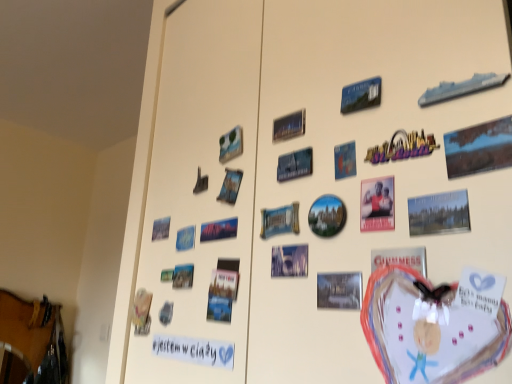
Image resolution: width=512 pixels, height=384 pixels. Describe the element at coordinates (361, 95) in the screenshot. I see `blue plastic postcard at upper right, which is the fifth postcard from right to left` at that location.

The image size is (512, 384). Describe the element at coordinates (161, 228) in the screenshot. I see `blue paper postcard at center-left, which is the 13th postcard in right-to-left order` at that location.

Image resolution: width=512 pixels, height=384 pixels. I want to click on matte plastic poster at center right, which ranks as the 4th postcard in right-to-left order, so click(x=377, y=204).

Find the location of `metallic rectangular poster at center`. metallic rectangular poster at center is located at coordinates (289, 126).

Describe the element at coordinates (400, 258) in the screenshot. I see `metallic silver postcard at center right, the 3th postcard positioned from the right` at that location.

At what (x,y) coordinates should I click in order to perform the action: click on blue plastic postcard at upper right, which is the fifth postcard from right to left. Please return your answer as a coordinate pair (x, y). This screenshot has width=512, height=384. Looking at the image, I should click on (361, 95).

Which is behind, point (445, 152) or point (228, 160)?

The point (228, 160) is more distant.

Considering the positions of objects metallic reflective landscape at upper right, acting as the 1th postcard starting from the right, and matte plastic postcard at upper center, the 4th postcard in the left-to-right sequence, in the image provided, who is more to the left, metallic reflective landscape at upper right, acting as the 1th postcard starting from the right, or matte plastic postcard at upper center, the 4th postcard in the left-to-right sequence,?

matte plastic postcard at upper center, the 4th postcard in the left-to-right sequence.

Is metallic reflective landscape at upper right, acting as the 1th postcard starting from the right, closer to camera compared to matte plastic postcard at upper center, the 10th postcard when ordered from right to left?

Yes, metallic reflective landscape at upper right, acting as the 1th postcard starting from the right, is in front of matte plastic postcard at upper center, the 10th postcard when ordered from right to left.

From the image's perspective, which one is positioned lower, metallic reflective landscape at upper right, acting as the 1th postcard starting from the right, or matte plastic postcard at upper center, the 4th postcard in the left-to-right sequence?

metallic reflective landscape at upper right, acting as the 1th postcard starting from the right.

The width and height of the screenshot is (512, 384). What are the coordinates of `writing below the matte plastic postcard at upper center, the 4th postcard in the left-to-right sequence (from the image's perspective)` in the screenshot? It's located at (194, 350).

Are white paper at lower left and matte plastic postcard at upper center, the 10th postcard when ordered from right to left, located far from each other?

They are positioned close to each other.

Between point (173, 357) and point (240, 147), which one is positioned in front?

The point (240, 147) is more forward.

Can matte plastic postcard at upper center, the 10th postcard when ordered from right to left, be found inside white paper at lower left?

No, matte plastic postcard at upper center, the 10th postcard when ordered from right to left, is located outside of white paper at lower left.

Who is shorter, matte plastic postcard at center, positioned as the 6th postcard in left-to-right order, or blue glossy postcard at center-left, the 11th postcard from the right?

With less height is blue glossy postcard at center-left, the 11th postcard from the right.

Can you tell me how much matte plastic postcard at center, which ranks as the eighth postcard in right-to-left order, and blue glossy postcard at center-left, the 3th postcard from the left, differ in facing direction?

The angle between the facing direction of matte plastic postcard at center, which ranks as the eighth postcard in right-to-left order, and the facing direction of blue glossy postcard at center-left, the 3th postcard from the left, is 4.41 degrees.

Relative to blue glossy postcard at center-left, the 11th postcard from the right, is matte plastic postcard at center, positioned as the 6th postcard in left-to-right order, in front or behind?

Clearly, matte plastic postcard at center, positioned as the 6th postcard in left-to-right order, is in front of blue glossy postcard at center-left, the 11th postcard from the right.

Is matte plastic postcard at center, which ranks as the eighth postcard in right-to-left order, bigger than blue glossy postcard at center-left, the 3th postcard from the left?

No.

Is metallic silver postcard at center, arranged as the 5th postcard when viewed from the left, in front of or behind blue paper at upper left, positioned as the second postcard in left-to-right order, in the image?

metallic silver postcard at center, arranged as the 5th postcard when viewed from the left, is positioned closer to the viewer than blue paper at upper left, positioned as the second postcard in left-to-right order.

How different are the orientations of metallic silver postcard at center, the ninth postcard when ordered from right to left, and blue paper at upper left, the twelfth postcard positioned from the right, in degrees?

The angle between the facing direction of metallic silver postcard at center, the ninth postcard when ordered from right to left, and the facing direction of blue paper at upper left, the twelfth postcard positioned from the right, is 3.31 degrees.

Which object is thinner, matte plastic postcard at center, positioned as the 6th postcard in left-to-right order, or metallic reflective landscape at upper right, positioned as the thirteenth postcard in left-to-right order?

Thinner between the two is metallic reflective landscape at upper right, positioned as the thirteenth postcard in left-to-right order.

Could metallic reflective landscape at upper right, acting as the 1th postcard starting from the right, be considered to be inside matte plastic postcard at center, positioned as the 6th postcard in left-to-right order?

Definitely not — metallic reflective landscape at upper right, acting as the 1th postcard starting from the right, is not inside matte plastic postcard at center, positioned as the 6th postcard in left-to-right order.

How many degrees apart are the facing directions of matte plastic postcard at center, positioned as the 6th postcard in left-to-right order, and metallic reflective landscape at upper right, acting as the 1th postcard starting from the right?

The angular difference between matte plastic postcard at center, positioned as the 6th postcard in left-to-right order, and metallic reflective landscape at upper right, acting as the 1th postcard starting from the right, is 0.898 degrees.

In terms of size, does matte plastic postcard at center, positioned as the 6th postcard in left-to-right order, appear bigger or smaller than metallic reflective landscape at upper right, positioned as the thirteenth postcard in left-to-right order?

Clearly, matte plastic postcard at center, positioned as the 6th postcard in left-to-right order, is smaller in size than metallic reflective landscape at upper right, positioned as the thirteenth postcard in left-to-right order.

Considering the sizes of objects metallic reflective landscape at upper right, acting as the 1th postcard starting from the right, and blue glossy postcard at center-left, the 11th postcard from the right, in the image provided, who is taller, metallic reflective landscape at upper right, acting as the 1th postcard starting from the right, or blue glossy postcard at center-left, the 11th postcard from the right,?

With more height is metallic reflective landscape at upper right, acting as the 1th postcard starting from the right.

Are metallic reflective landscape at upper right, positioned as the thirteenth postcard in left-to-right order, and blue glossy postcard at center-left, the 3th postcard from the left, far apart?

Actually, metallic reflective landscape at upper right, positioned as the thirteenth postcard in left-to-right order, and blue glossy postcard at center-left, the 3th postcard from the left, are a little close together.

How far apart are metallic reflective landscape at upper right, acting as the 1th postcard starting from the right, and blue glossy postcard at center-left, the 3th postcard from the left?

metallic reflective landscape at upper right, acting as the 1th postcard starting from the right, is 18.06 inches away from blue glossy postcard at center-left, the 3th postcard from the left.

Is blue glossy postcard at center-left, the 3th postcard from the left, turned away from metallic rectangular poster at center?

No.

Between blue glossy postcard at center-left, the 3th postcard from the left, and metallic rectangular poster at center, which one has smaller size?

blue glossy postcard at center-left, the 3th postcard from the left, is smaller.

Is blue glossy postcard at center-left, the 11th postcard from the right, further to camera compared to metallic rectangular poster at center?

Yes.

From the image's perspective, which one is positioned higher, blue glossy postcard at center-left, the 11th postcard from the right, or metallic rectangular poster at center?

metallic rectangular poster at center, from the image's perspective.

You are a GUI agent. You are given a task and a screenshot of the screen. Output one action in this format:
    pyautogui.click(x=<x>, y=<y>)
    Task: Click on the postcard that is the 1st one when counting upward from the metallic reflective landscape at upper right, positioned as the thirteenth postcard in left-to-right order (from the image's perspective)
    
    Given the screenshot: What is the action you would take?
    pyautogui.click(x=231, y=145)

Locate an element on the screen. The width and height of the screenshot is (512, 384). writing in front of the matte plastic postcard at upper center, the 4th postcard in the left-to-right sequence is located at coordinates (194, 350).

Considering their positions, is blue glossy postcard at upper center, the eighth postcard in the left-to-right sequence, positioned further to metallic silver postcard at center, the ninth postcard when ordered from right to left, than metallic rectangular poster at center?

metallic rectangular poster at center.

From the image, which object appears to be farther from matte paper postcard at upper right, arranged as the 12th postcard when viewed from the left, blue plastic postcard at upper right, which is the fifth postcard from right to left, or matte plastic postcard at upper center, the 4th postcard in the left-to-right sequence?

matte plastic postcard at upper center, the 4th postcard in the left-to-right sequence, is positioned further to the anchor matte paper postcard at upper right, arranged as the 12th postcard when viewed from the left.

Considering their positions, is metallic rectangular poster at center positioned closer to metallic silver postcard at center right, placed as the 11th postcard when sorted from left to right, than matte plastic poster at center right, which ranks as the 4th postcard in right-to-left order?

matte plastic poster at center right, which ranks as the 4th postcard in right-to-left order, lies closer to metallic silver postcard at center right, placed as the 11th postcard when sorted from left to right, than the other object.

In the scene shown: Estimate the real-world distances between objects in this image. Which object is closer to blue plastic postcard at upper right, which is the fifth postcard from right to left, matte plastic postcard at center, which ranks as the eighth postcard in right-to-left order, or blue paper postcard at center-left, the 1th postcard when ordered from left to right?

matte plastic postcard at center, which ranks as the eighth postcard in right-to-left order, lies closer to blue plastic postcard at upper right, which is the fifth postcard from right to left, than the other object.

Looking at the image, which one is located further to metallic reflective landscape at upper right, positioned as the thirteenth postcard in left-to-right order, matte plastic poster at center right, which ranks as the 4th postcard in right-to-left order, or metallic rectangular poster at center?

Based on the image, metallic rectangular poster at center appears to be further to metallic reflective landscape at upper right, positioned as the thirteenth postcard in left-to-right order.

Looking at the image, which one is located closer to metallic silver postcard at center right, placed as the 11th postcard when sorted from left to right, blue paper postcard at center-left, the 1th postcard when ordered from left to right, or matte plastic poster at center right, which ranks as the 4th postcard in right-to-left order?

matte plastic poster at center right, which ranks as the 4th postcard in right-to-left order, lies closer to metallic silver postcard at center right, placed as the 11th postcard when sorted from left to right, than the other object.

From the image, which object appears to be nearer to blue plastic postcard at upper right, the 9th postcard in the left-to-right sequence, matte paper postcard at upper right, which is the second postcard from right to left, or white paper at lower left?

Among the two, matte paper postcard at upper right, which is the second postcard from right to left, is located nearer to blue plastic postcard at upper right, the 9th postcard in the left-to-right sequence.

Which object lies nearer to the anchor point blue paper at upper left, the twelfth postcard positioned from the right, metallic reflective landscape at upper right, acting as the 1th postcard starting from the right, or white paper at lower left?

Among the two, white paper at lower left is located nearer to blue paper at upper left, the twelfth postcard positioned from the right.

Find the location of a particular element. This screenshot has height=384, width=512. poster between blue paper postcard at center-left, which is the 13th postcard in right-to-left order, and blue glossy postcard at upper center, the eighth postcard in the left-to-right sequence, in the horizontal direction is located at coordinates (289, 126).

The image size is (512, 384). In order to click on poster situated between blue paper at upper left, the twelfth postcard positioned from the right, and blue glossy postcard at upper center, the eighth postcard in the left-to-right sequence, from left to right in this screenshot , I will do `click(289, 126)`.

This screenshot has width=512, height=384. Identify the location of writing located between metallic silver postcard at center, which is the 7th postcard in left-to-right order, and blue paper at upper left, the twelfth postcard positioned from the right, in the depth direction. (194, 350).

The width and height of the screenshot is (512, 384). What are the coordinates of `poster between matte plastic postcard at center, positioned as the 6th postcard in left-to-right order, and matte plastic postcard at upper center, the 4th postcard in the left-to-right sequence, along the z-axis` in the screenshot? It's located at (289, 126).